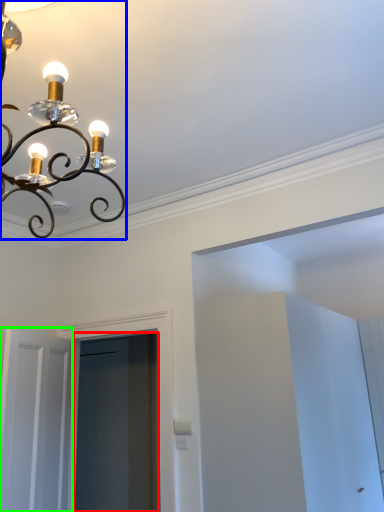
Question: Which object is the farthest from screen door (highlighted by a red box)? Choose among these: lamp (highlighted by a blue box) or door (highlighted by a green box).

Choices:
 (A) lamp
 (B) door

Answer: (A)